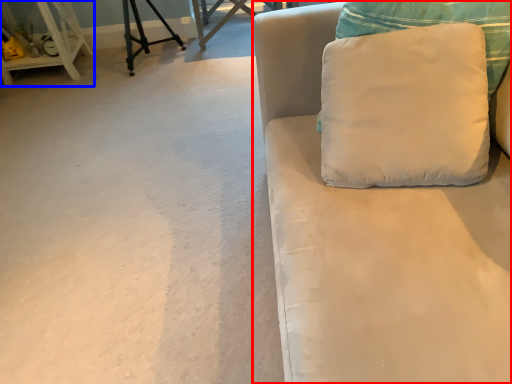
Question: Which object appears closest to the camera in this image, studio couch (highlighted by a red box) or furniture (highlighted by a blue box)?

Choices:
 (A) studio couch
 (B) furniture

Answer: (A)